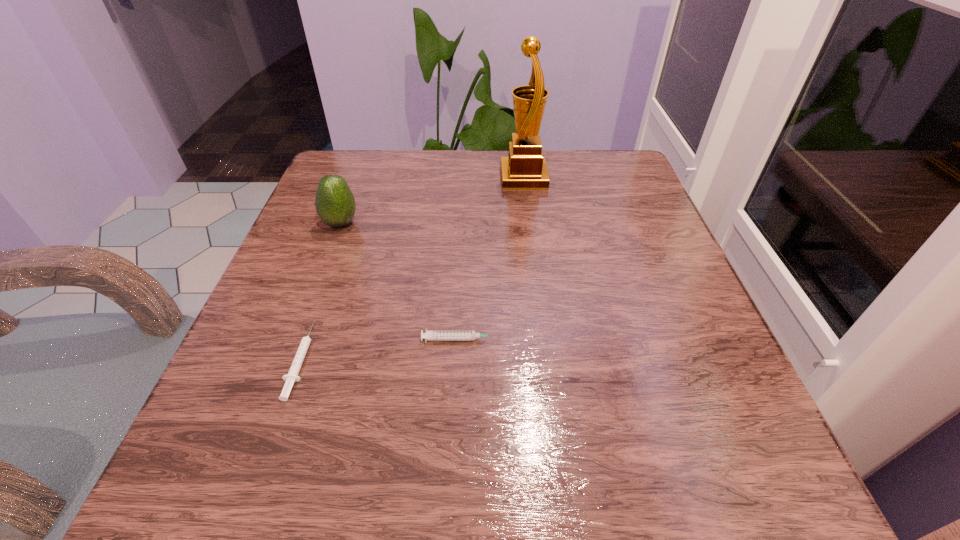
You are a GUI agent. You are given a task and a screenshot of the screen. Output one action in this format:
    pyautogui.click(x=<x>, y=<y>)
    Task: Click on the vacant space located 0.390m on the front-facing side of the award
    Image resolution: width=960 pixels, height=540 pixels.
    Given the screenshot: What is the action you would take?
    pyautogui.click(x=338, y=177)

Identify the location of free space located 0.260m on the front of the third nearest object. (299, 337).

Identify the location of free space located 0.130m at the needle end of the third tallest object. The width and height of the screenshot is (960, 540). (583, 339).

Locate an element on the screen. The height and width of the screenshot is (540, 960). free space located 0.060m on the back of the left syringe is located at coordinates (323, 297).

Locate an element on the screen. object located at the far edge is located at coordinates 525,168.

The height and width of the screenshot is (540, 960). What are the coordinates of `avocado positioned at the left edge` in the screenshot? It's located at (335, 204).

This screenshot has width=960, height=540. Find the location of `syringe at the left edge`. syringe at the left edge is located at coordinates (292, 376).

In the image, there is a desktop. What are the coordinates of `vacant space at the far edge` in the screenshot? It's located at (478, 186).

In order to click on free region at the left edge in this screenshot , I will do [331, 234].

Locate an element on the screen. The image size is (960, 540). vacant region at the right edge of the desktop is located at coordinates (697, 322).